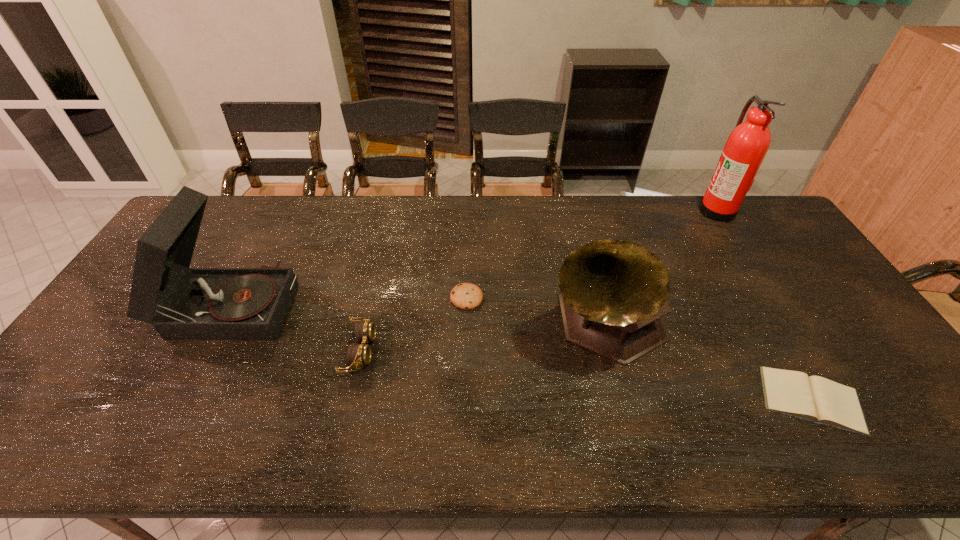
Identify the location of fire extinguisher at the right edge. pyautogui.click(x=747, y=145).

Locate an element on the screen. The height and width of the screenshot is (540, 960). Bible situated at the right edge is located at coordinates (817, 399).

Identify the location of object at the far right corner. Image resolution: width=960 pixels, height=540 pixels. (747, 145).

Identify the location of object situated at the near right corner. This screenshot has width=960, height=540. (817, 399).

Locate an element on the screen. The height and width of the screenshot is (540, 960). free point at the far edge is located at coordinates (608, 225).

Image resolution: width=960 pixels, height=540 pixels. What are the coordinates of `free space at the left edge of the desktop` in the screenshot? It's located at (94, 343).

Locate an element on the screen. free space at the right edge of the desktop is located at coordinates (833, 293).

Where is `free space at the near right corner of the desktop`? Image resolution: width=960 pixels, height=540 pixels. free space at the near right corner of the desktop is located at coordinates (921, 426).

Identify the location of empty location between the fifth tallest object and the third shortest object. (414, 325).

This screenshot has width=960, height=540. Find the location of `free area in between the fourth object from left to right and the second shortest object`. free area in between the fourth object from left to right and the second shortest object is located at coordinates (536, 310).